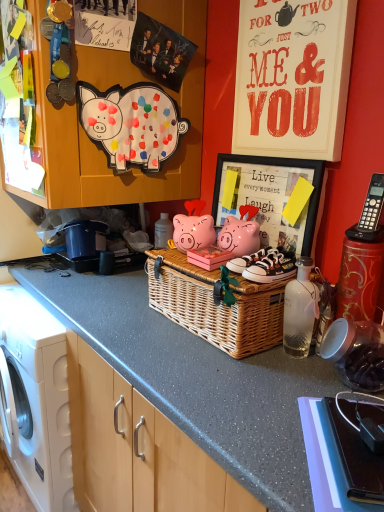
Question: Is wooden cabinet at upper left wider than transparent glass bottle at center?

Choices:
 (A) no
 (B) yes

Answer: (B)

Question: Does wooden cabinet at upper left have a larger size compared to transparent glass bottle at center?

Choices:
 (A) yes
 (B) no

Answer: (A)

Question: Does wooden cabinet at upper left appear on the left side of transparent glass bottle at center?

Choices:
 (A) no
 (B) yes

Answer: (B)

Question: From a real-world perspective, is wooden cabinet at upper left located higher than transparent glass bottle at center?

Choices:
 (A) no
 (B) yes

Answer: (B)

Question: Is wooden cabinet at upper left located outside transparent glass bottle at center?

Choices:
 (A) no
 (B) yes

Answer: (B)

Question: Is wooden cabinet at upper left surrounding transparent glass bottle at center?

Choices:
 (A) yes
 (B) no

Answer: (B)

Question: Could you tell me if white paper at upper right is turned towards transparent glass bottle at center?

Choices:
 (A) yes
 (B) no

Answer: (B)

Question: Can you confirm if white paper at upper right is wider than transparent glass bottle at center?

Choices:
 (A) no
 (B) yes

Answer: (A)

Question: Is transparent glass bottle at center located within white paper at upper right?

Choices:
 (A) yes
 (B) no

Answer: (B)

Question: Would you say white paper at upper right is outside transparent glass bottle at center?

Choices:
 (A) no
 (B) yes

Answer: (B)

Question: Is white paper at upper right thinner than transparent glass bottle at center?

Choices:
 (A) no
 (B) yes

Answer: (B)

Question: Does white paper at upper right appear on the left side of transparent glass bottle at center?

Choices:
 (A) yes
 (B) no

Answer: (A)

Question: Is black plastic phone at upper right not within white canvas sneakers at center, arranged as the second footwear when viewed from the back?

Choices:
 (A) no
 (B) yes

Answer: (B)